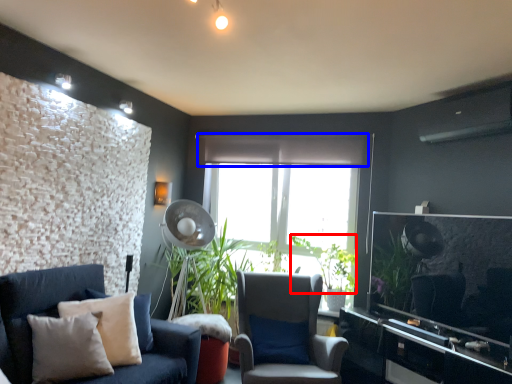
Question: Which of the following is the farthest to the observer, plant (highlighted by a red box) or curtain (highlighted by a blue box)?

Choices:
 (A) plant
 (B) curtain

Answer: (B)